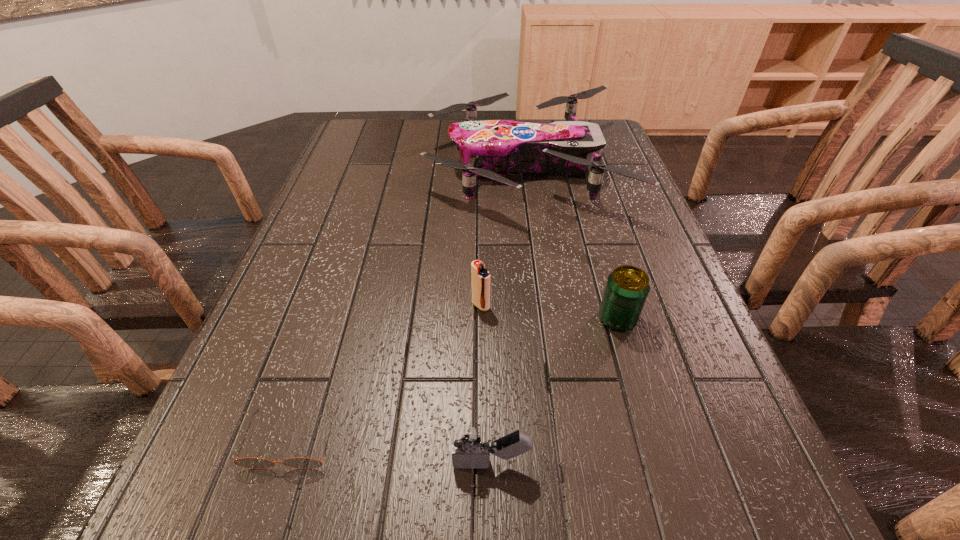
The width and height of the screenshot is (960, 540). Identify the location of free space that satisfies the following two spatial constraints: 1. on the front-facing side of the beer can; 2. on the right side of the farthest object. (544, 319).